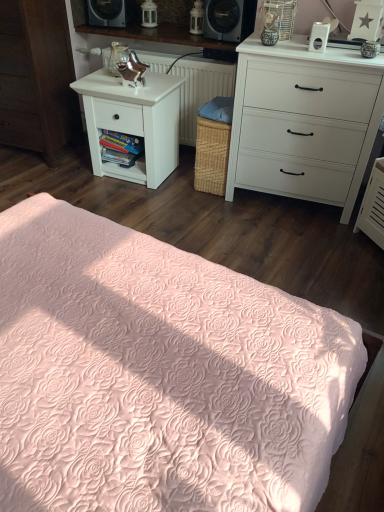
At what (x,y) coordinates should I click in order to perform the action: click on white wood nightstand at left. Please return your answer as a coordinate pair (x, y). Looking at the image, I should click on (36, 77).

Measure the distance between point [186,141] and camera.

They are 3.26 meters apart.

This screenshot has width=384, height=512. Describe the element at coordinates (159, 375) in the screenshot. I see `pink quilted bedspread at lower center` at that location.

Measure the distance between white matte chest of drawers at upper right and camera.

2.05 meters.

You are a GUI agent. You are given a task and a screenshot of the screen. Output one action in this format:
    pyautogui.click(x=<x>, y=<y>)
    Task: Click on the white wood nightstand at left
    
    Given the screenshot: What is the action you would take?
    pyautogui.click(x=36, y=77)

From the image's perspective, which one is positioned higher, white wood nightstand at left or white textured radiator at center?

white textured radiator at center, from the image's perspective.

Is white wood nightstand at left touching white textured radiator at center?

They are not placed beside each other.

Between white wood nightstand at left and white textured radiator at center, which one is positioned in front?

Positioned in front is white wood nightstand at left.

Which is correct: white wood nightstand at left is inside white matte nightstand at left, or outside of it?

white wood nightstand at left is located beyond the bounds of white matte nightstand at left.

Who is smaller, white wood nightstand at left or white matte nightstand at left?

With smaller size is white matte nightstand at left.

From a real-world perspective, does white wood nightstand at left stand above white matte nightstand at left?

Yes, from a real-world perspective, white wood nightstand at left is above white matte nightstand at left.

Is point (52, 413) closer to camera compared to point (157, 180)?

Yes.

You are a GUI agent. You are given a task and a screenshot of the screen. Output one action in this format:
    pyautogui.click(x=<x>, y=<y>)
    Task: Click on the bed that is in front of the white matte nightstand at left
    The width and height of the screenshot is (384, 512).
    Given the screenshot: What is the action you would take?
    pyautogui.click(x=159, y=375)

Which is more to the right, pink quilted bedspread at lower center or white matte nightstand at left?

From the viewer's perspective, pink quilted bedspread at lower center appears more on the right side.

Is pink quilted bedspread at lower center next to white matte nightstand at left?

No, pink quilted bedspread at lower center is not beside white matte nightstand at left.

In the scene shown: Is white textured radiator at center wider than white matte chest of drawers at upper right?

Yes, white textured radiator at center is wider than white matte chest of drawers at upper right.

Between white textured radiator at center and white matte chest of drawers at upper right, which one has more height?

With more height is white matte chest of drawers at upper right.

Is white textured radiator at center to the left of white matte chest of drawers at upper right from the viewer's perspective?

Yes.

Is white matte chest of drawers at upper right positioned with its back to white textured radiator at center?

white matte chest of drawers at upper right is not turned away from white textured radiator at center.

From a real-world perspective, who is located higher, white matte chest of drawers at upper right or white textured radiator at center?

In real-world perspective, white matte chest of drawers at upper right is above.

Would you say white matte chest of drawers at upper right is inside or outside white textured radiator at center?

white matte chest of drawers at upper right is outside white textured radiator at center.

Looking at this image, from the image's perspective, relative to white textured radiator at center, is white matte chest of drawers at upper right above or below?

white matte chest of drawers at upper right is situated lower than white textured radiator at center in the image.

Considering the sizes of objects white matte chest of drawers at upper right and white matte nightstand at left in the image provided, who is shorter, white matte chest of drawers at upper right or white matte nightstand at left?

white matte nightstand at left is shorter.

Could you tell me if white matte chest of drawers at upper right is facing white matte nightstand at left?

No, white matte chest of drawers at upper right is not aimed at white matte nightstand at left.

In the scene shown: Measure the distance between white matte chest of drawers at upper right and white matte nightstand at left.

white matte chest of drawers at upper right is 31.01 inches away from white matte nightstand at left.

Is white matte chest of drawers at upper right positioned before white matte nightstand at left?

Yes, white matte chest of drawers at upper right is in front of white matte nightstand at left.

Which point is more distant from viewer, (108, 85) or (207, 93)?

The point (207, 93) is behind.

Considering the sizes of objects white matte nightstand at left and white textured radiator at center in the image provided, who is shorter, white matte nightstand at left or white textured radiator at center?

With less height is white matte nightstand at left.

Which object is more forward, white matte nightstand at left or white textured radiator at center?

white matte nightstand at left.

Locate an element on the screen. The height and width of the screenshot is (512, 384). radiator located above the white matte nightstand at left (from a real-world perspective) is located at coordinates (200, 90).

Identify the location of cabinetry above the white textured radiator at center (from a real-world perspective). (36, 77).

Image resolution: width=384 pixels, height=512 pixels. What are the coordinates of `cabinetry on the left of white matte nightstand at left` in the screenshot? It's located at (36, 77).

From the picture: From the image, which object appears to be farther from white matte chest of drawers at upper right, white textured radiator at center or white matte nightstand at left?

white matte nightstand at left lies further to white matte chest of drawers at upper right than the other object.

From the picture: Estimate the real-world distances between objects in this image. Which object is closer to white wood nightstand at left, white matte chest of drawers at upper right or white matte nightstand at left?

white matte nightstand at left is closer to white wood nightstand at left.

Based on their spatial positions, is white matte nightstand at left or white textured radiator at center further from white matte chest of drawers at upper right?

Based on the image, white matte nightstand at left appears to be further to white matte chest of drawers at upper right.

When comparing their distances from pink quilted bedspread at lower center, does white matte chest of drawers at upper right or white textured radiator at center seem further?

The object further to pink quilted bedspread at lower center is white textured radiator at center.

Based on their spatial positions, is pink quilted bedspread at lower center or white matte chest of drawers at upper right further from white wood nightstand at left?

pink quilted bedspread at lower center is positioned further to the anchor white wood nightstand at left.

Based on their spatial positions, is white wood nightstand at left or white matte chest of drawers at upper right closer to white matte nightstand at left?

Based on the image, white wood nightstand at left appears to be nearer to white matte nightstand at left.

Based on their spatial positions, is white matte nightstand at left or white matte chest of drawers at upper right closer to white wood nightstand at left?

The object closer to white wood nightstand at left is white matte nightstand at left.

Which object lies further to the anchor point white wood nightstand at left, white matte nightstand at left or pink quilted bedspread at lower center?

The object further to white wood nightstand at left is pink quilted bedspread at lower center.

You are a GUI agent. You are given a task and a screenshot of the screen. Output one action in this format:
    pyautogui.click(x=<x>, y=<y>)
    Task: Click on the nightstand located between white wood nightstand at left and white textured radiator at center in the left-right direction
    
    Given the screenshot: What is the action you would take?
    pyautogui.click(x=134, y=122)

Locate an element on the screen. This screenshot has height=512, width=384. chest of drawers between pink quilted bedspread at lower center and white wood nightstand at left along the z-axis is located at coordinates (304, 121).

Where is `chest of drawers between pink quilted bedspread at lower center and white textured radiator at center from front to back`? chest of drawers between pink quilted bedspread at lower center and white textured radiator at center from front to back is located at coordinates (304, 121).

The image size is (384, 512). Find the location of `nightstand between white wood nightstand at left and white matte chest of drawers at upper right`. nightstand between white wood nightstand at left and white matte chest of drawers at upper right is located at coordinates (134, 122).